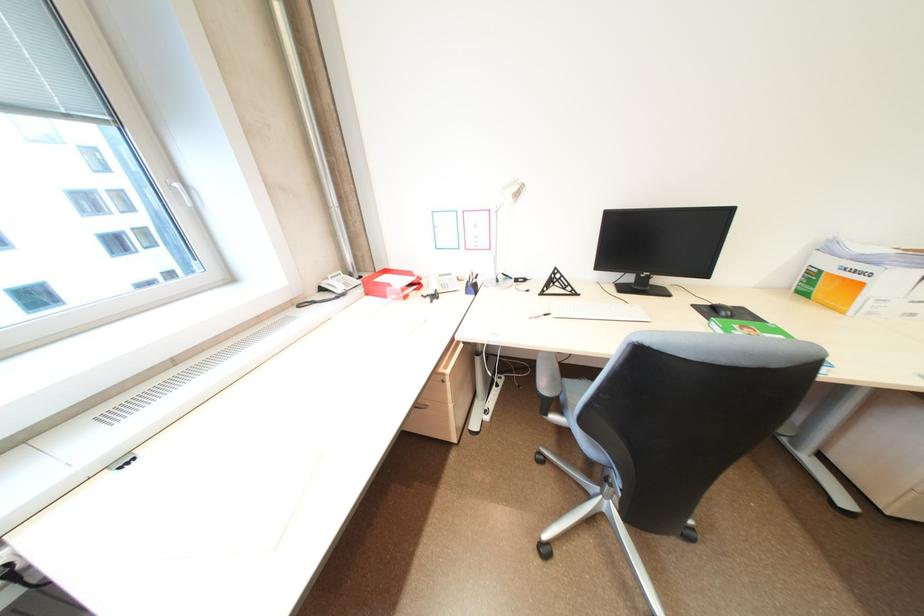
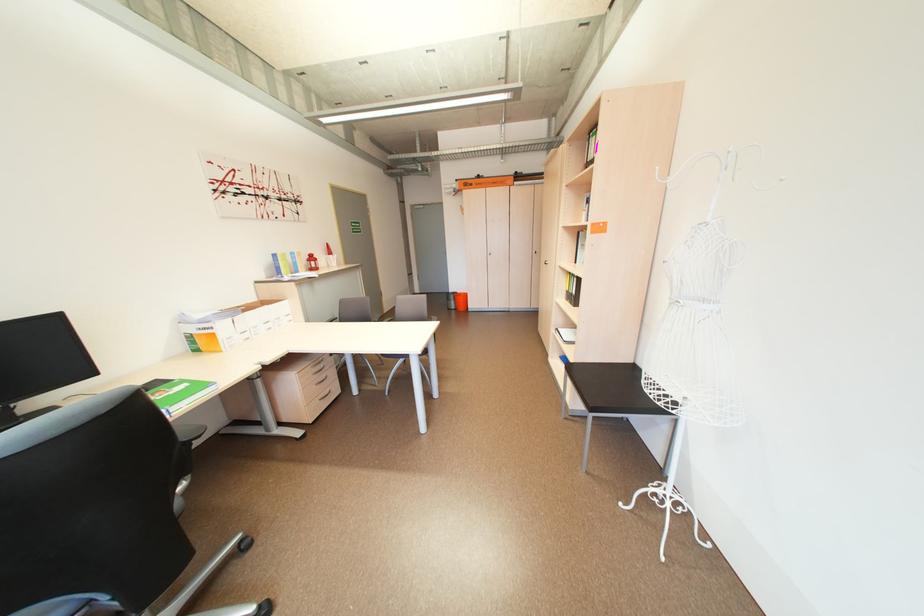
Locate, in the second image, the point that corresponds to the point at 750,310 in the first image.

(164, 382)